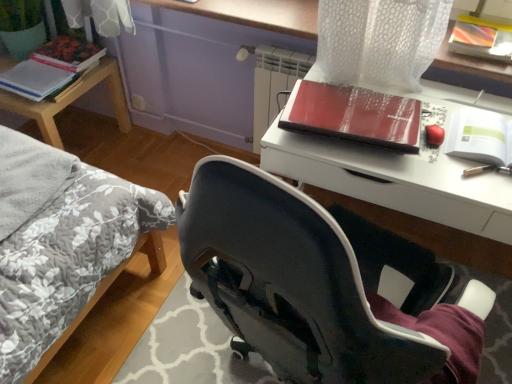
Question: Is matte hardcover book at upper left, which is the first paperback book in top-to-bottom order, wider or thinner than matte black desk at upper right?

Choices:
 (A) wide
 (B) thin

Answer: (B)

Question: Considering their positions, is matte hardcover book at upper left, the third paperback book from the front, located in front of or behind matte black desk at upper right?

Choices:
 (A) behind
 (B) front

Answer: (A)

Question: Which object is the closest to the woodenmaterial/texturetable at left?

Choices:
 (A) matte paper notebook at left, positioned as the second paperback book in top-to-bottom order
 (B) shiny red book at upper right
 (C) matte hardcover book at upper left, the third paperback book from the front
 (D) green matte paperback book at upper right, the first paperback book from the bottom
 (E) matte black desk at upper right

Answer: (A)

Question: Which of these objects is positioned closest to the matte black desk at upper right?

Choices:
 (A) woodenmaterial/texturetable at left
 (B) matte paper notebook at left, positioned as the second paperback book in top-to-bottom order
 (C) matte hardcover book at upper left, the 2th paperback book when ordered from left to right
 (D) shiny red book at upper right
 (E) green matte paperback book at upper right, the 3th paperback book positioned from the back

Answer: (D)